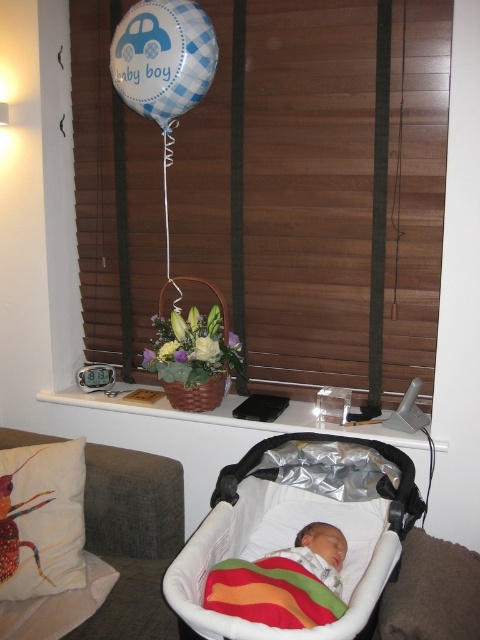
Based on the photo, you are a parent preparing to place a blue checkered balloon at upper center into a white fabric baby carriage at lower center. Can the balloon fit inside the carriage?

The white fabric baby carriage at lower center might be wider than blue checkered balloon at upper center, so there is a possibility that the balloon can fit inside the carriage. However, without exact measurements, it is uncertain.

You are a parent checking on your baby in the nursery. You see the rainbow striped fabric at center and the soft white swaddle at center. Which fabric is shorter?

The rainbow striped fabric at center is shorter than the soft white swaddle at center.